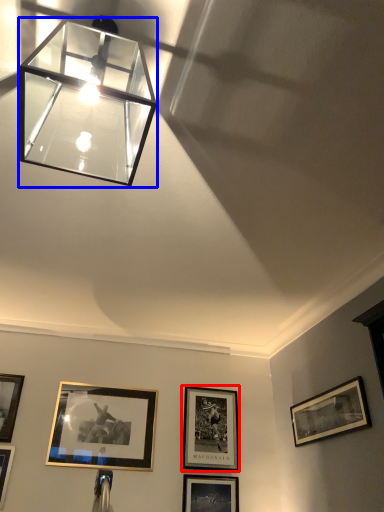
Question: Which object appears farthest to the camera in this image, picture frame (highlighted by a red box) or lamp (highlighted by a blue box)?

Choices:
 (A) picture frame
 (B) lamp

Answer: (A)